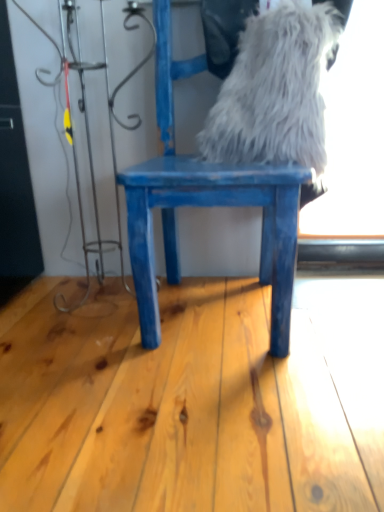
Question: Should I look upward or downward to see blue painted wood chair at center?

Choices:
 (A) down
 (B) up

Answer: (B)

Question: Is blue painted wood chair at center in contact with white fluffy fur at upper center?

Choices:
 (A) no
 (B) yes

Answer: (A)

Question: Is blue painted wood chair at center oriented towards white fluffy fur at upper center?

Choices:
 (A) yes
 (B) no

Answer: (B)

Question: Can you confirm if blue painted wood chair at center is wider than white fluffy fur at upper center?

Choices:
 (A) no
 (B) yes

Answer: (B)

Question: Is blue painted wood chair at center closer to the viewer compared to white fluffy fur at upper center?

Choices:
 (A) no
 (B) yes

Answer: (B)

Question: Is blue painted wood chair at center far from white fluffy fur at upper center?

Choices:
 (A) yes
 (B) no

Answer: (B)

Question: Can you confirm if blue painted wood chair at center is smaller than white fluffy fur at upper center?

Choices:
 (A) yes
 (B) no

Answer: (B)

Question: Considering the relative positions of white fluffy fur at upper center and blue painted wood chair at center in the image provided, is white fluffy fur at upper center in front of blue painted wood chair at center?

Choices:
 (A) no
 (B) yes

Answer: (A)

Question: Is white fluffy fur at upper center positioned behind blue painted wood chair at center?

Choices:
 (A) yes
 (B) no

Answer: (A)

Question: From the image's perspective, is white fluffy fur at upper center over blue painted wood chair at center?

Choices:
 (A) no
 (B) yes

Answer: (B)

Question: Is white fluffy fur at upper center touching blue painted wood chair at center?

Choices:
 (A) yes
 (B) no

Answer: (B)

Question: Is white fluffy fur at upper center aimed at blue painted wood chair at center?

Choices:
 (A) no
 (B) yes

Answer: (B)

Question: Considering the relative sizes of white fluffy fur at upper center and blue painted wood chair at center in the image provided, is white fluffy fur at upper center wider than blue painted wood chair at center?

Choices:
 (A) no
 (B) yes

Answer: (A)

Question: Looking at the image, does blue painted wood chair at center seem bigger or smaller compared to white fluffy fur at upper center?

Choices:
 (A) big
 (B) small

Answer: (A)